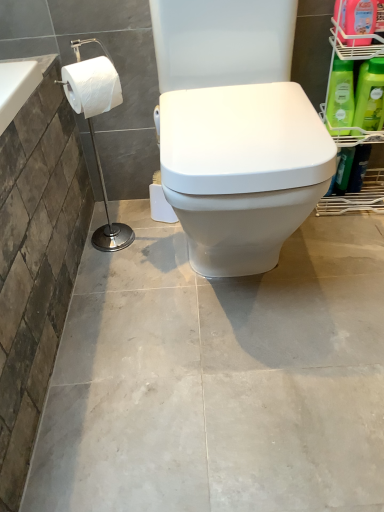
Question: Is point (360, 8) closer or farther from the camera than point (258, 5)?

Choices:
 (A) closer
 (B) farther

Answer: (B)

Question: Based on their sizes in the image, would you say pink plastic bottle at upper right, the first cleaning product in the top-to-bottom sequence, is bigger or smaller than white glossy toilet at center?

Choices:
 (A) small
 (B) big

Answer: (A)

Question: Estimate the real-world distances between objects in this image. Which object is farther from the white glossy toilet at center?

Choices:
 (A) green matte bottle at right, positioned as the third cleaning product in top-to-bottom order
 (B) white matte toilet paper at left
 (C) pink plastic bottle at upper right, acting as the 3th cleaning product starting from the bottom
 (D) green plastic shelf at right
 (E) green matte bottle at upper right, which is the second cleaning product from top to bottom

Answer: (A)

Question: Estimate the real-world distances between objects in this image. Which object is closer to the white paper towel at left?

Choices:
 (A) green matte bottle at right, the first cleaning product from the bottom
 (B) white matte toilet paper at left
 (C) pink plastic bottle at upper right, the first cleaning product in the top-to-bottom sequence
 (D) white glossy toilet at center
 (E) green plastic shelf at right

Answer: (B)